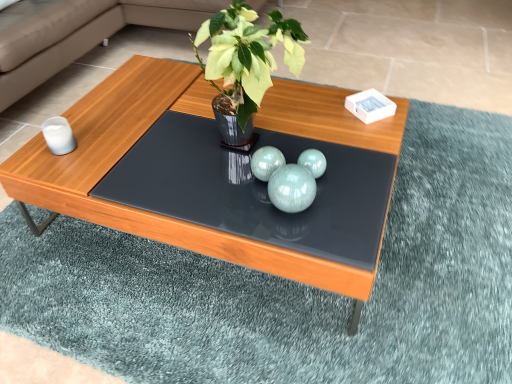
Where is `vacant space behind teal glossy spheres at center`? This screenshot has height=384, width=512. vacant space behind teal glossy spheres at center is located at coordinates (281, 151).